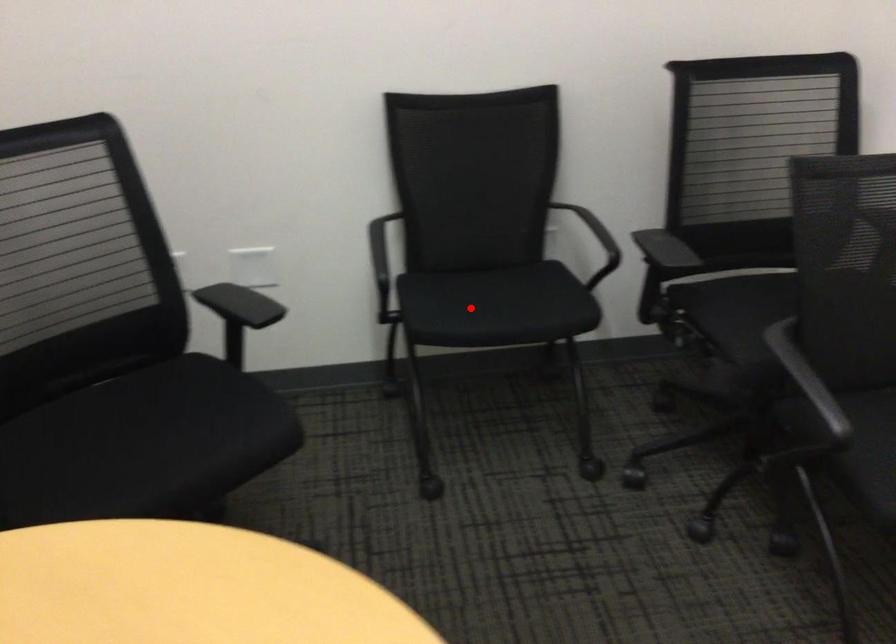
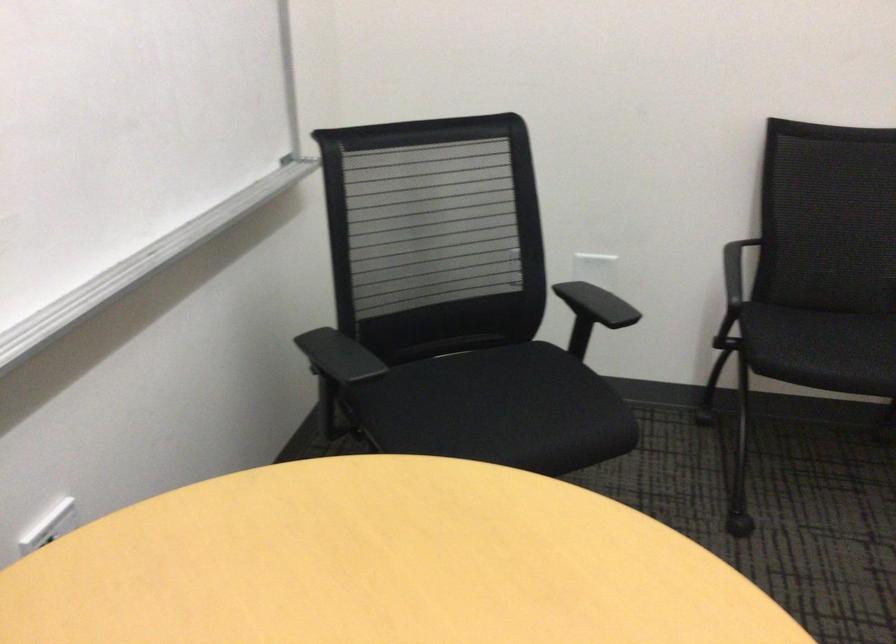
Find the pixel in the second image that matches the highlighted location in the first image.

(821, 348)